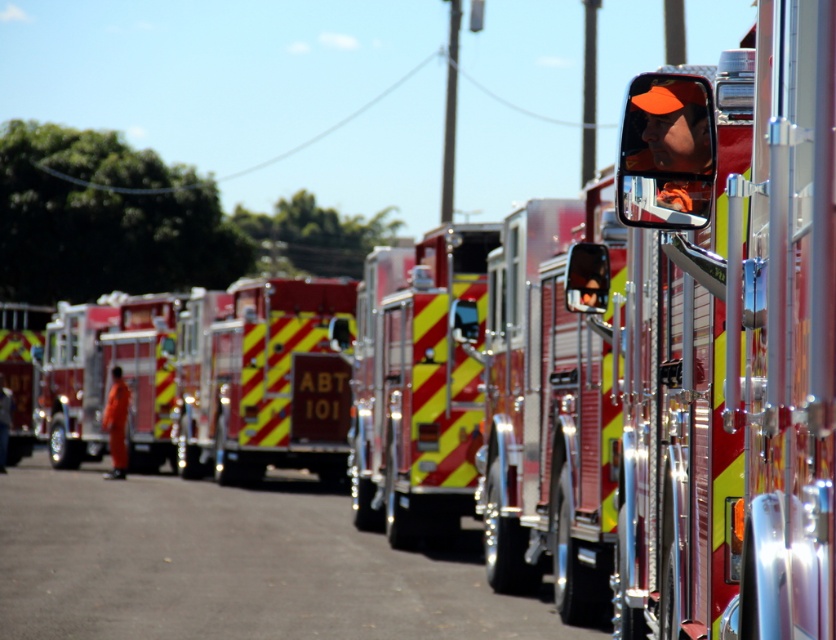
Measure the distance from yellow reflective fire truck at center to red/yellow striped fire truck at left.

yellow reflective fire truck at center and red/yellow striped fire truck at left are 8.12 meters apart.

Between yellow reflective fire truck at center and red/yellow striped fire truck at left, which one appears on the right side from the viewer's perspective?

Positioned to the right is yellow reflective fire truck at center.

Find the location of a particular element. Image resolution: width=836 pixels, height=640 pixels. yellow reflective fire truck at center is located at coordinates (263, 381).

Does reflective silver fire truck at center appear under red/yellow striped fire truck at left?

Actually, reflective silver fire truck at center is above red/yellow striped fire truck at left.

Between reflective silver fire truck at center and red/yellow striped fire truck at left, which one is positioned higher?

reflective silver fire truck at center

This screenshot has width=836, height=640. I want to click on reflective silver fire truck at center, so click(416, 388).

Locate an element on the screen. reflective silver fire truck at center is located at coordinates tap(416, 388).

Is yellow reflective fire truck at center behind metallic red fire truck at left?

No, yellow reflective fire truck at center is closer to the viewer.

Is yellow reflective fire truck at center thinner than metallic red fire truck at left?

Yes, yellow reflective fire truck at center is thinner than metallic red fire truck at left.

The height and width of the screenshot is (640, 836). In order to click on yellow reflective fire truck at center in this screenshot , I will do tap(263, 381).

You are a GUI agent. You are given a task and a screenshot of the screen. Output one action in this format:
    pyautogui.click(x=<x>, y=<y>)
    Task: Click on the yellow reflective fire truck at center
    This screenshot has width=836, height=640.
    Given the screenshot: What is the action you would take?
    pyautogui.click(x=263, y=381)